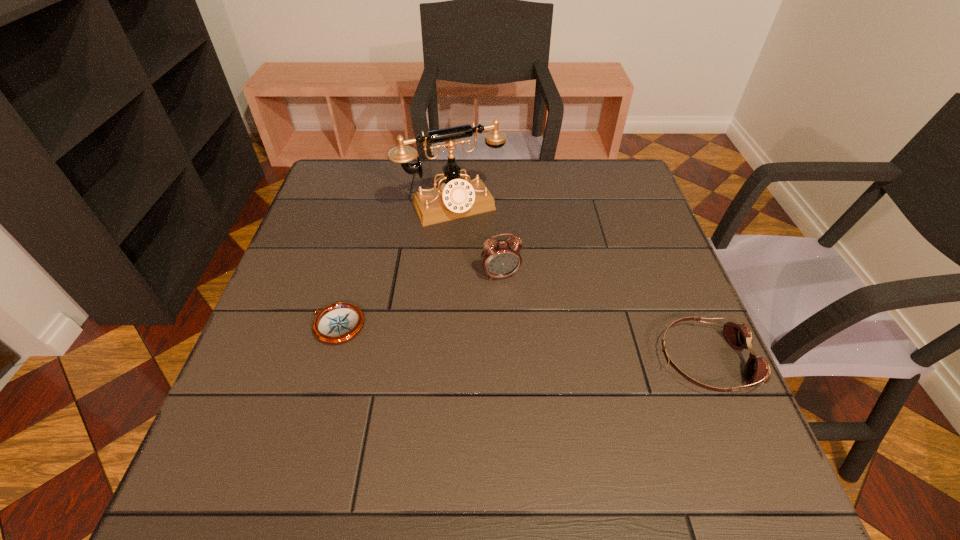
This screenshot has width=960, height=540. What are the coordinates of `vacant space on the desktop that is between the leftmost object and the second shortest object and is positioned on the face of the third nearest object` in the screenshot? It's located at [524, 343].

Where is `vacant space on the desktop that is between the leftmost object and the third tallest object and is positioned on the dial of the tallest object`? vacant space on the desktop that is between the leftmost object and the third tallest object and is positioned on the dial of the tallest object is located at coordinates (525, 343).